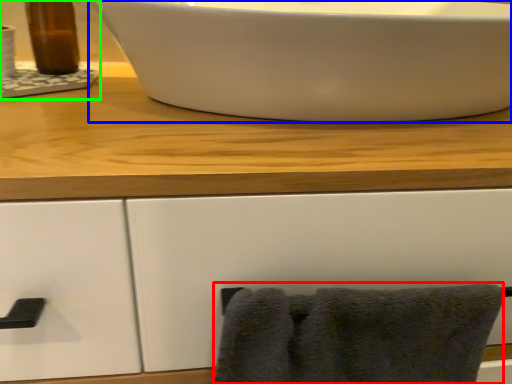
Question: Which object is the closest to the bath towel (highlighted by a red box)? Choose among these: sink (highlighted by a blue box) or sink (highlighted by a green box).

Choices:
 (A) sink
 (B) sink

Answer: (A)